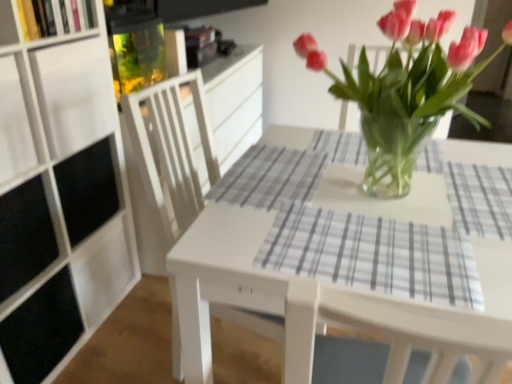
Question: Is pink glass vase at center positioned with its back to white glossy table at center?

Choices:
 (A) yes
 (B) no

Answer: (B)

Question: Does pink glass vase at center appear on the left side of white glossy table at center?

Choices:
 (A) no
 (B) yes

Answer: (B)

Question: From the image's perspective, would you say pink glass vase at center is positioned over white glossy table at center?

Choices:
 (A) yes
 (B) no

Answer: (A)

Question: From a real-world perspective, is pink glass vase at center on white glossy table at center?

Choices:
 (A) no
 (B) yes

Answer: (B)

Question: Is pink glass vase at center at the right side of white glossy table at center?

Choices:
 (A) no
 (B) yes

Answer: (A)

Question: Relative to white wood chair at center, is gray plaid placemat at center in front or behind?

Choices:
 (A) front
 (B) behind

Answer: (A)

Question: In terms of height, does gray plaid placemat at center look taller or shorter compared to white wood chair at center?

Choices:
 (A) tall
 (B) short

Answer: (B)

Question: From a real-world perspective, is gray plaid placemat at center physically located above or below white wood chair at center?

Choices:
 (A) below
 (B) above

Answer: (B)

Question: From the image's perspective, is gray plaid placemat at center above or below white wood chair at center?

Choices:
 (A) below
 (B) above

Answer: (B)

Question: Based on their sizes in the image, would you say white matte shelf at upper left, which is counted as the 1th shelf, starting from the bottom, is bigger or smaller than gray plaid placemat at center?

Choices:
 (A) big
 (B) small

Answer: (A)

Question: In the image, is white matte shelf at upper left, which is counted as the 1th shelf, starting from the bottom, positioned in front of or behind gray plaid placemat at center?

Choices:
 (A) front
 (B) behind

Answer: (B)

Question: Based on their positions, is white matte shelf at upper left, which is counted as the 1th shelf, starting from the bottom, located to the left or right of gray plaid placemat at center?

Choices:
 (A) right
 (B) left

Answer: (B)

Question: Is white matte shelf at upper left, which is counted as the 1th shelf, starting from the bottom, taller or shorter than gray plaid placemat at center?

Choices:
 (A) tall
 (B) short

Answer: (A)

Question: Is white wood chair at center taller or shorter than gray plaid placemat at center?

Choices:
 (A) short
 (B) tall

Answer: (B)

Question: Does point pyautogui.click(x=260, y=319) appear closer or farther from the camera than point pyautogui.click(x=407, y=268)?

Choices:
 (A) closer
 (B) farther

Answer: (B)